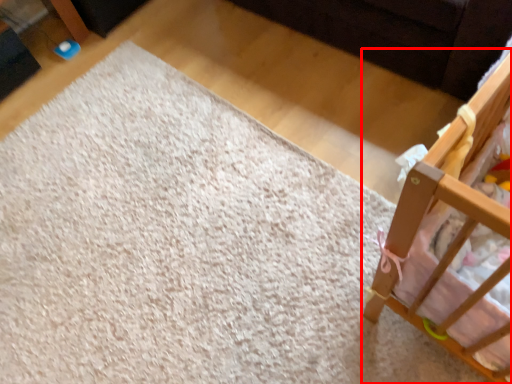
Question: From the image, what is the correct spatial relationship of infant bed (annotated by the red box) in relation to mat?

Choices:
 (A) right
 (B) left

Answer: (A)